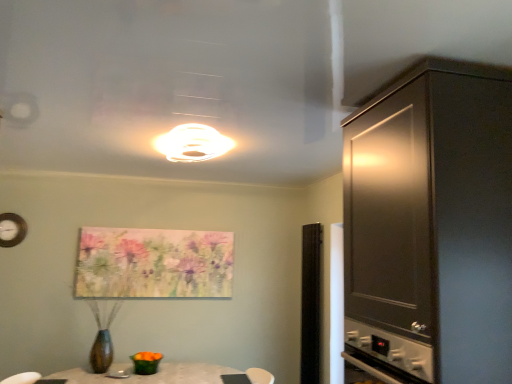
Question: Is point (224, 243) positioned closer to the camera than point (172, 130)?

Choices:
 (A) farther
 (B) closer

Answer: (A)

Question: From a real-world perspective, is pastel floral canvas at center positioned above or below white glossy light fixture at upper center?

Choices:
 (A) below
 (B) above

Answer: (A)

Question: Which object is the closest to the transparent glass door at center?

Choices:
 (A) dark wood cabinet at right
 (B) white glossy light fixture at upper center
 (C) pastel floral canvas at center

Answer: (C)

Question: Based on their relative distances, which object is farther from the pastel floral canvas at center?

Choices:
 (A) dark wood cabinet at right
 (B) transparent glass door at center
 (C) white glossy light fixture at upper center

Answer: (A)